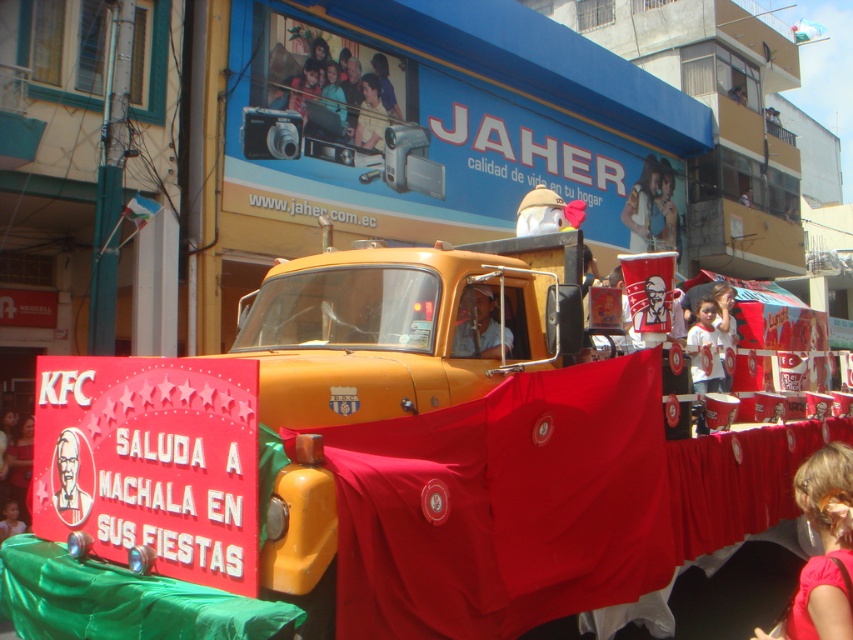
You are a photographer holding a yellow plastic camera at upper center and want to take a photo of the matte orange truck at center. Since you are standing in front of the truck, will the truck appear larger or smaller in your photo compared to the yellow plastic camera?

The matte orange truck at center is closer to the viewer than the yellow plastic camera at upper center. Since the truck is closer, it will appear larger in the photo compared to the camera.

You are a photographer standing in the crowd watching the KFC truck parade. You have a yellow plastic camera at upper center. Can you take a photo of the entire matte orange truck at center without moving your camera? Explain why or why not based on their sizes.

The matte orange truck at center is taller than the yellow plastic camera at upper center. Since the truck is taller, the camera might not have enough vertical coverage to capture the entire truck in one shot without moving it.

From the picture: You are a photographer standing in the crowd watching the KFC parade truck. You want to take a photo of both the matte black laptop at upper center and the smooth plastic cup at upper center. Can you see both objects in the same frame without moving your camera?

The matte black laptop at upper center is above the smooth plastic cup at upper center, so yes, both objects can be captured in the same frame without moving the camera since they are vertically aligned.